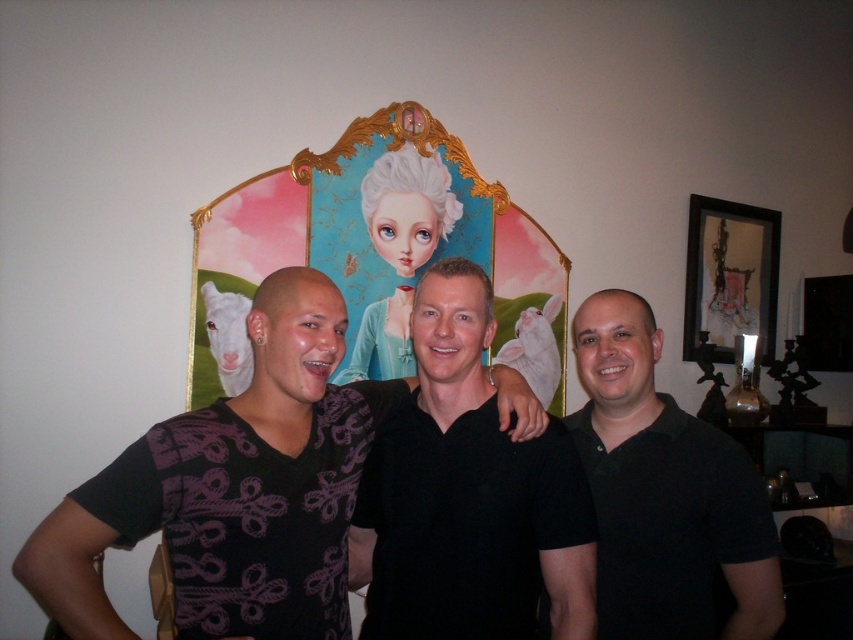
You are a photographer standing in front of the three people. You want to take a photo that includes both the purple printed shirt at center and the matte black picture frame at upper right. Is there enough space between them to fit both in the frame?

The distance between the purple printed shirt at center and the matte black picture frame at upper right is 8.83 feet. Since the photographer is standing in front of them, the horizontal distance between the two objects may not directly affect the framing. However, if the camera has a wide enough lens, both can likely be captured in the same frame.

You are standing in front of the image and want to locate the black matte shirt at right. According to the coordinates given, where is it positioned in the image?

The black matte shirt at right is positioned at the coordinates point (664,492) in the image.